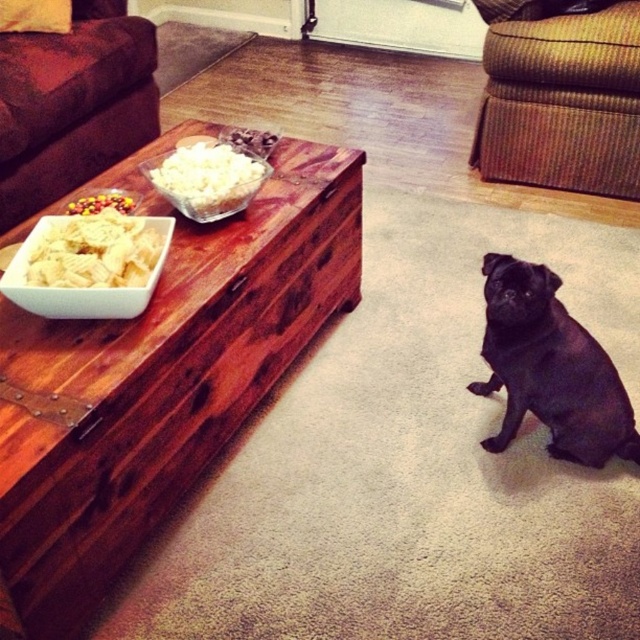
You are standing in the living room and want to place a small plant between the two points marked as point (573, 88) and point (118, 198). Which point should the plant be closer to in order to be closer to the viewer?

The plant should be closer to point (573, 88) because it is further to the viewer than point (118, 198).

You are sitting on the brown fabric couch at upper left and want to reach the white popcorn at center. Which direction should you move to get closer to the popcorn?

You should move to the right because the white popcorn at center is to the right of the brown fabric couch at upper left.